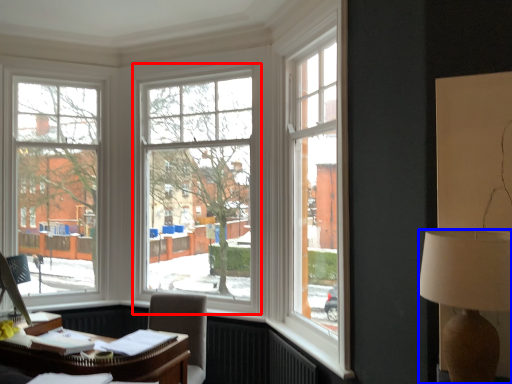
Question: Which of the following is the closest to the observer, window (highlighted by a red box) or lamp (highlighted by a blue box)?

Choices:
 (A) window
 (B) lamp

Answer: (B)